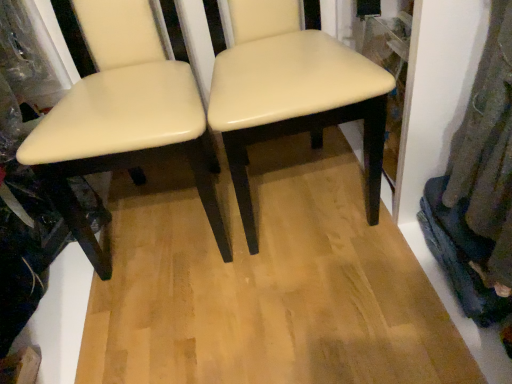
Find the location of a particular element. The image size is (512, 384). matte cream chair at center, the 1th chair in the left-to-right sequence is located at coordinates (124, 116).

The height and width of the screenshot is (384, 512). What do you see at coordinates (124, 116) in the screenshot? I see `matte cream chair at center, the 1th chair in the left-to-right sequence` at bounding box center [124, 116].

The width and height of the screenshot is (512, 384). In order to click on cream matte chair at center, the second chair when ordered from left to right in this screenshot , I will do `click(291, 92)`.

What do you see at coordinates (291, 92) in the screenshot? This screenshot has width=512, height=384. I see `cream matte chair at center, the second chair when ordered from left to right` at bounding box center [291, 92].

Find the location of a particular element. This screenshot has width=512, height=384. matte cream chair at center, the 1th chair in the left-to-right sequence is located at coordinates (124, 116).

Which object is positioned more to the right, cream matte chair at center, the 1th chair when ordered from right to left, or matte cream chair at center, placed as the 2th chair when sorted from right to left?

cream matte chair at center, the 1th chair when ordered from right to left, is more to the right.

Considering the relative positions of cream matte chair at center, the 1th chair when ordered from right to left, and matte cream chair at center, placed as the 2th chair when sorted from right to left, in the image provided, is cream matte chair at center, the 1th chair when ordered from right to left, in front of matte cream chair at center, placed as the 2th chair when sorted from right to left,?

No, it is behind matte cream chair at center, placed as the 2th chair when sorted from right to left.

Is point (298, 41) positioned after point (123, 120)?

Yes, it is.

From the picture: From the image's perspective, is cream matte chair at center, the second chair when ordered from left to right, located above matte cream chair at center, placed as the 2th chair when sorted from right to left?

Correct, cream matte chair at center, the second chair when ordered from left to right, appears higher than matte cream chair at center, placed as the 2th chair when sorted from right to left, in the image.

From a real-world perspective, is cream matte chair at center, the second chair when ordered from left to right, located beneath matte cream chair at center, the 1th chair in the left-to-right sequence?

Yes, from a real-world perspective, cream matte chair at center, the second chair when ordered from left to right, is beneath matte cream chair at center, the 1th chair in the left-to-right sequence.

Considering the sizes of objects cream matte chair at center, the second chair when ordered from left to right, and matte cream chair at center, the 1th chair in the left-to-right sequence, in the image provided, who is thinner, cream matte chair at center, the second chair when ordered from left to right, or matte cream chair at center, the 1th chair in the left-to-right sequence,?

Thinner between the two is matte cream chair at center, the 1th chair in the left-to-right sequence.

Is cream matte chair at center, the 1th chair when ordered from right to left, taller or shorter than matte cream chair at center, the 1th chair in the left-to-right sequence?

In the image, cream matte chair at center, the 1th chair when ordered from right to left, appears to be shorter than matte cream chair at center, the 1th chair in the left-to-right sequence.

Can you confirm if cream matte chair at center, the 1th chair when ordered from right to left, is bigger than matte cream chair at center, placed as the 2th chair when sorted from right to left?

No.

Is cream matte chair at center, the second chair when ordered from left to right, spatially inside matte cream chair at center, the 1th chair in the left-to-right sequence, or outside of it?

The correct answer is: outside.

Is cream matte chair at center, the 1th chair when ordered from right to left, directly adjacent to matte cream chair at center, placed as the 2th chair when sorted from right to left?

No.

Is cream matte chair at center, the second chair when ordered from left to right, facing towards matte cream chair at center, placed as the 2th chair when sorted from right to left?

No, cream matte chair at center, the second chair when ordered from left to right, is not facing towards matte cream chair at center, placed as the 2th chair when sorted from right to left.

Measure the distance from cream matte chair at center, the 1th chair when ordered from right to left, to matte cream chair at center, placed as the 2th chair when sorted from right to left.

They are 9.43 inches apart.

In order to click on chair on the left of cream matte chair at center, the 1th chair when ordered from right to left in this screenshot , I will do `click(124, 116)`.

Is matte cream chair at center, the 1th chair in the left-to-right sequence, to the right of cream matte chair at center, the second chair when ordered from left to right, from the viewer's perspective?

In fact, matte cream chair at center, the 1th chair in the left-to-right sequence, is to the left of cream matte chair at center, the second chair when ordered from left to right.

Considering the positions of objects matte cream chair at center, placed as the 2th chair when sorted from right to left, and cream matte chair at center, the second chair when ordered from left to right, in the image provided, who is in front, matte cream chair at center, placed as the 2th chair when sorted from right to left, or cream matte chair at center, the second chair when ordered from left to right,?

matte cream chair at center, placed as the 2th chair when sorted from right to left.

Which is nearer, [203,161] or [303,33]?

Point [203,161] is positioned closer to the camera compared to point [303,33].

From the image's perspective, would you say matte cream chair at center, placed as the 2th chair when sorted from right to left, is shown under cream matte chair at center, the second chair when ordered from left to right?

Yes, from the image's perspective, matte cream chair at center, placed as the 2th chair when sorted from right to left, is beneath cream matte chair at center, the second chair when ordered from left to right.

From a real-world perspective, is matte cream chair at center, placed as the 2th chair when sorted from right to left, over cream matte chair at center, the second chair when ordered from left to right?

Yes.

Looking at their sizes, would you say matte cream chair at center, placed as the 2th chair when sorted from right to left, is wider or thinner than cream matte chair at center, the second chair when ordered from left to right?

In the image, matte cream chair at center, placed as the 2th chair when sorted from right to left, appears to be more narrow than cream matte chair at center, the second chair when ordered from left to right.

Considering the relative sizes of matte cream chair at center, placed as the 2th chair when sorted from right to left, and cream matte chair at center, the second chair when ordered from left to right, in the image provided, is matte cream chair at center, placed as the 2th chair when sorted from right to left, shorter than cream matte chair at center, the second chair when ordered from left to right,?

No.

Considering the sizes of matte cream chair at center, placed as the 2th chair when sorted from right to left, and cream matte chair at center, the 1th chair when ordered from right to left, in the image, is matte cream chair at center, placed as the 2th chair when sorted from right to left, bigger or smaller than cream matte chair at center, the 1th chair when ordered from right to left,?

In the image, matte cream chair at center, placed as the 2th chair when sorted from right to left, appears to be larger than cream matte chair at center, the 1th chair when ordered from right to left.

Is matte cream chair at center, the 1th chair in the left-to-right sequence, situated inside cream matte chair at center, the 1th chair when ordered from right to left, or outside?

matte cream chair at center, the 1th chair in the left-to-right sequence, is not enclosed by cream matte chair at center, the 1th chair when ordered from right to left.

Is matte cream chair at center, the 1th chair in the left-to-right sequence, positioned far away from cream matte chair at center, the 1th chair when ordered from right to left?

That's not correct — matte cream chair at center, the 1th chair in the left-to-right sequence, is a little close to cream matte chair at center, the 1th chair when ordered from right to left.

Is matte cream chair at center, the 1th chair in the left-to-right sequence, oriented away from cream matte chair at center, the second chair when ordered from left to right?

No, matte cream chair at center, the 1th chair in the left-to-right sequence, is not facing the opposite direction of cream matte chair at center, the second chair when ordered from left to right.

How many degrees apart are the facing directions of matte cream chair at center, placed as the 2th chair when sorted from right to left, and cream matte chair at center, the 1th chair when ordered from right to left?

They differ by 3.35 degrees in their facing directions.

Where is `chair behind the matte cream chair at center, the 1th chair in the left-to-right sequence`? Image resolution: width=512 pixels, height=384 pixels. chair behind the matte cream chair at center, the 1th chair in the left-to-right sequence is located at coordinates (291, 92).

Locate an element on the screen. chair on the right of matte cream chair at center, the 1th chair in the left-to-right sequence is located at coordinates (291, 92).

There is a cream matte chair at center, the 1th chair when ordered from right to left. At what (x,y) coordinates should I click in order to perform the action: click on chair above it (from a real-world perspective). Please return your answer as a coordinate pair (x, y). The width and height of the screenshot is (512, 384). Looking at the image, I should click on (124, 116).